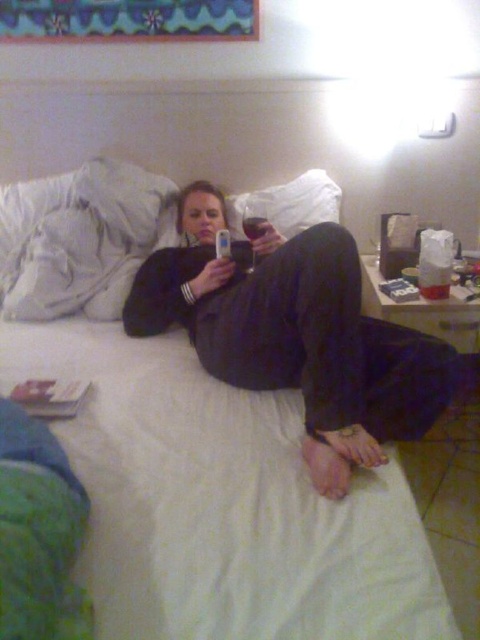
Can you confirm if white fabric bed at center is smaller than white soft pillow at upper left?

No.

Is white fabric bed at center positioned behind white soft pillow at upper left?

That is False.

Is point (108, 486) less distant than point (39, 227)?

That is True.

The width and height of the screenshot is (480, 640). I want to click on white fabric bed at center, so click(220, 502).

Between matte black phone at center and white soft pillow at upper left, which one is positioned lower?

matte black phone at center

Can you confirm if matte black phone at center is thinner than white soft pillow at upper left?

No, matte black phone at center is not thinner than white soft pillow at upper left.

Is point (305, 381) positioned behind point (14, 298)?

No, (305, 381) is closer to viewer.

In order to click on matte black phone at center in this screenshot , I will do `click(295, 333)`.

Image resolution: width=480 pixels, height=640 pixels. Describe the element at coordinates (220, 502) in the screenshot. I see `white fabric bed at center` at that location.

Can you confirm if white fabric bed at center is positioned to the right of matte black phone at center?

Incorrect, white fabric bed at center is not on the right side of matte black phone at center.

Locate an element on the screen. white fabric bed at center is located at coordinates (220, 502).